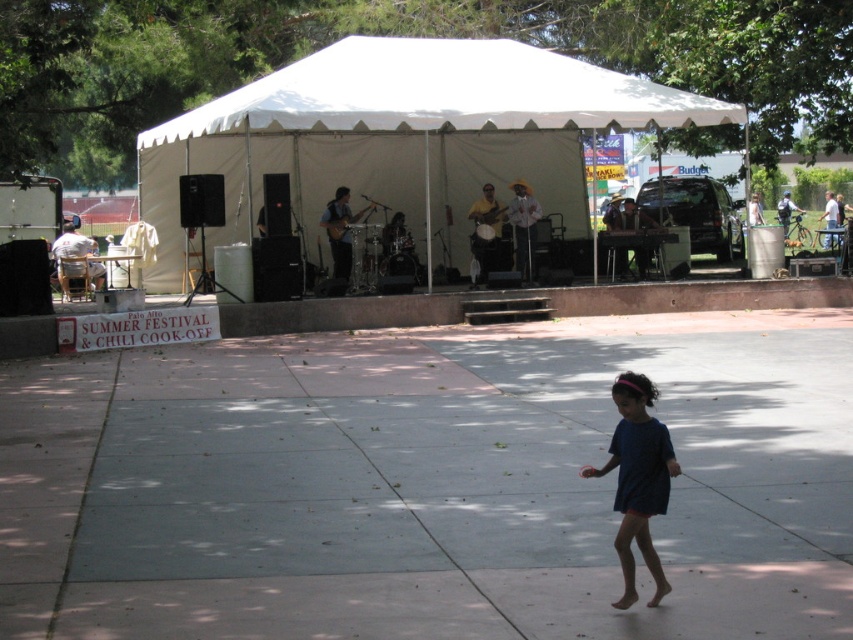
You are standing at the point labeled point (x=245, y=90) and want to walk to the stage. Which direction should you move relative to the point labeled point (x=572, y=490)?

You should move towards the point labeled point (x=572, y=490) because it is closer to the camera and the stage is likely in that direction.

You are attending the Palo Alto SUMMER event and want to walk to the stage. You are currently standing on the gray concrete pavement at lower center. Which direction should you move to reach the white canvas tent at center?

Since the gray concrete pavement at lower center is closer to the viewer than the white canvas tent at center, you should move forward towards the white canvas tent at center to reach the stage.

You are attending the Palo Alto SUMMER event and want to know how far you are from the gray concrete pavement at lower center. Can you determine the distance?

The distance between you and the gray concrete pavement at lower center is 5.46 meters.